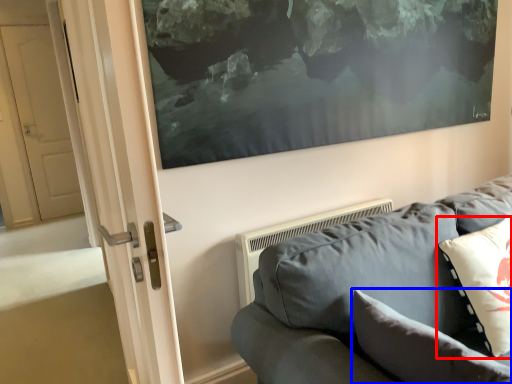
Question: Which object appears farthest to the camera in this image, pillow (highlighted by a red box) or pillow (highlighted by a blue box)?

Choices:
 (A) pillow
 (B) pillow

Answer: (A)